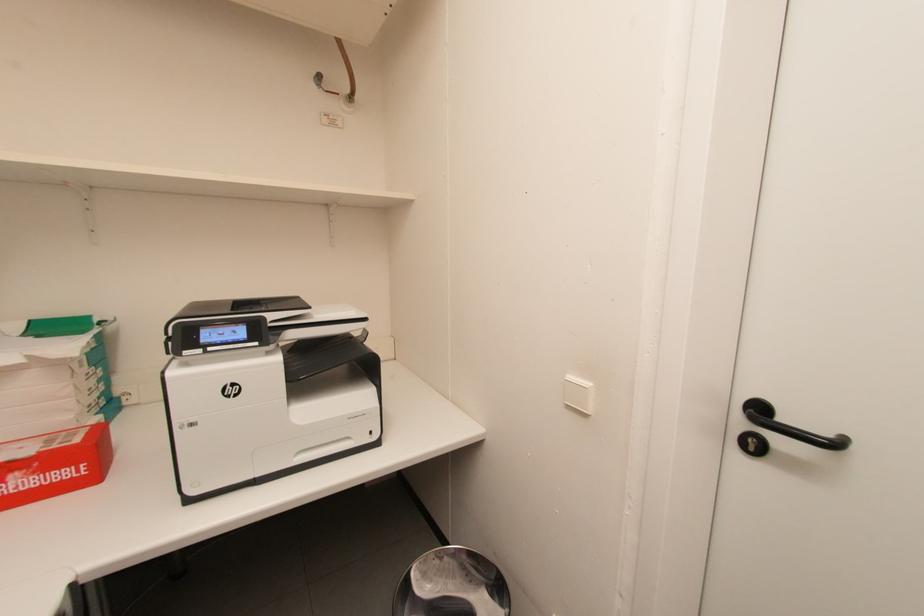
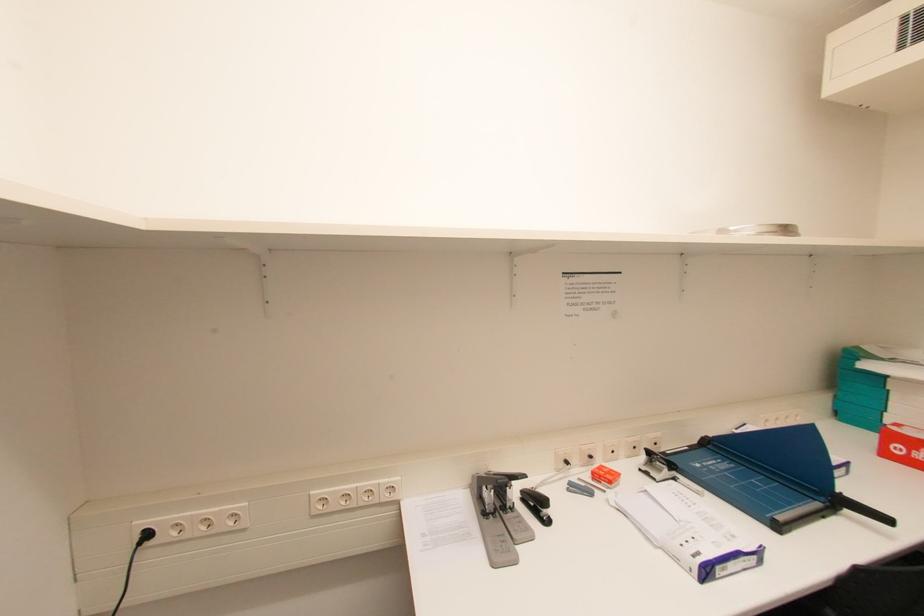
Question: The camera is either moving clockwise (left) or counter-clockwise (right) around the object. The first image is from the beginning of the video and the second image is from the end. Is the camera moving left or right when shooting the video?

Choices:
 (A) Left
 (B) Right

Answer: (B)